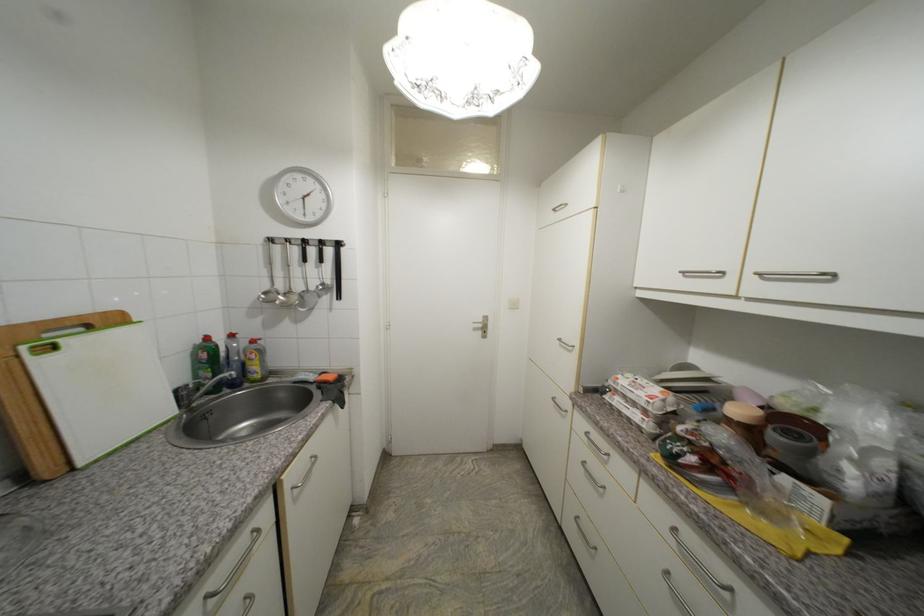
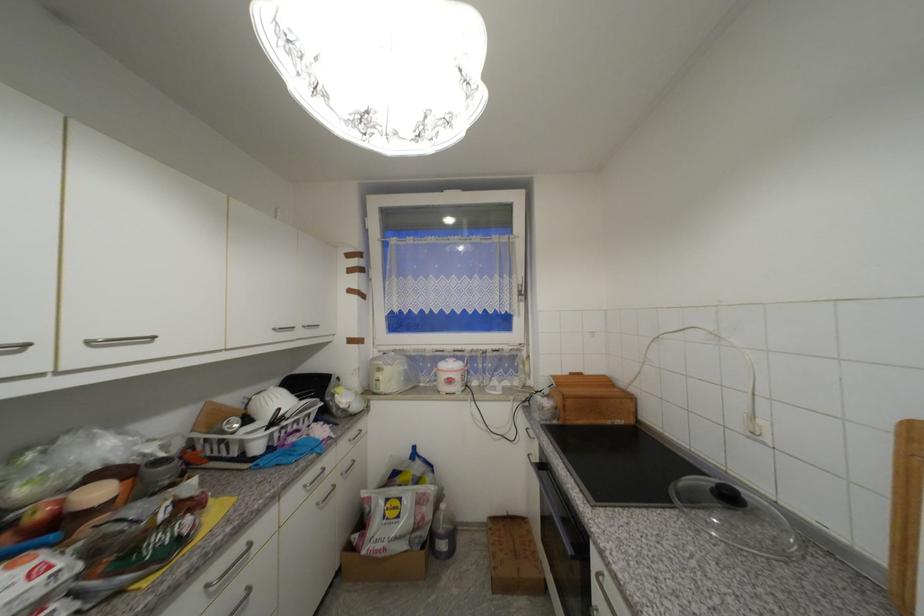
Find the pixel in the second image that matches (681,531) in the first image.

(213, 588)